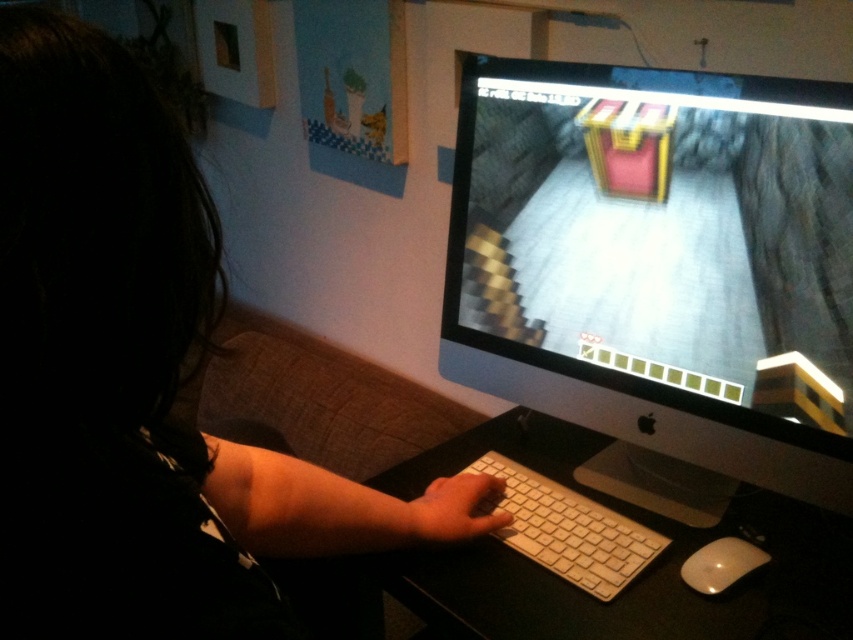
Question: Which object appears farthest from the camera in this image?

Choices:
 (A) white plastic keyboard at center
 (B) white plastic keyboard at lower center
 (C) black matte keyboard at lower center

Answer: (B)

Question: Is black plastic monitor at center above black matte keyboard at lower center?

Choices:
 (A) yes
 (B) no

Answer: (A)

Question: From the image, what is the correct spatial relationship of black plastic monitor at center in relation to white plastic keyboard at lower center?

Choices:
 (A) below
 (B) above

Answer: (B)

Question: Is black matte keyboard at lower center to the right of white plastic keyboard at lower center from the viewer's perspective?

Choices:
 (A) no
 (B) yes

Answer: (A)

Question: Which of these objects is positioned farthest from the black matte keyboard at lower center?

Choices:
 (A) white glossy mouse at lower right
 (B) white plastic keyboard at lower center
 (C) white plastic keyboard at center
 (D) black plastic monitor at center

Answer: (A)

Question: Among these points, which one is nearest to the camera?

Choices:
 (A) (787, 634)
 (B) (798, 474)

Answer: (A)